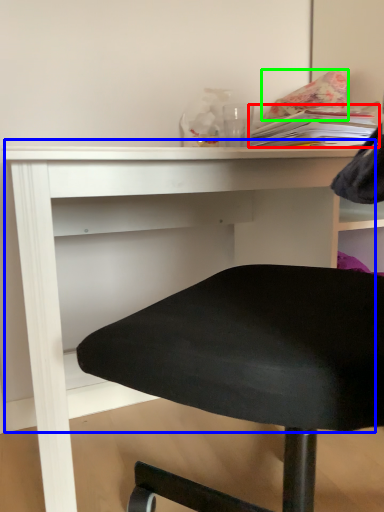
Question: Which is farther away from book (highlighted by a red box)? table (highlighted by a blue box) or pillow (highlighted by a green box)?

Choices:
 (A) table
 (B) pillow

Answer: (A)